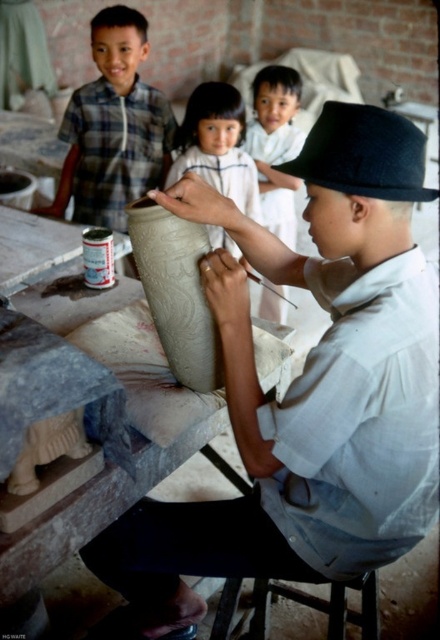
Question: Which point appears closest to the camera in this image?

Choices:
 (A) (123, 145)
 (B) (250, 216)
 (C) (249, 128)

Answer: (A)

Question: Which of the following is the farthest from the observer?

Choices:
 (A) checkered fabric shirt at upper left
 (B) smooth beige vase at center

Answer: (A)

Question: Does checkered fabric shirt at upper left appear on the left side of smooth beige vase at center?

Choices:
 (A) yes
 (B) no

Answer: (A)

Question: Is checkered fabric shirt at upper left in front of white cotton shirt at upper center?

Choices:
 (A) yes
 (B) no

Answer: (A)

Question: Among these objects, which one is nearest to the camera?

Choices:
 (A) smooth beige vase at center
 (B) white cotton shirt at upper center
 (C) checkered fabric shirt at upper left

Answer: (A)

Question: Does smooth beige vase at center come in front of white cotton shirt at upper center?

Choices:
 (A) no
 (B) yes

Answer: (B)